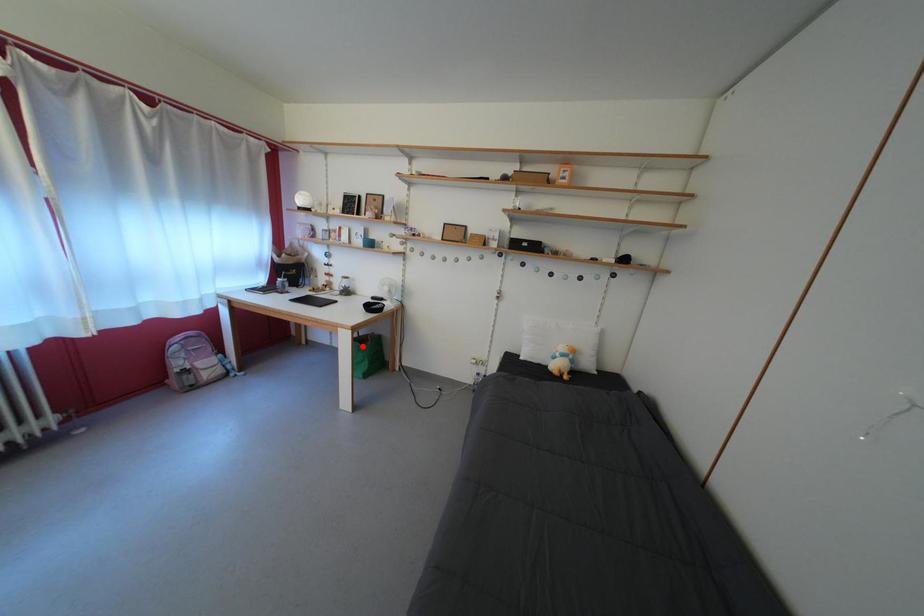
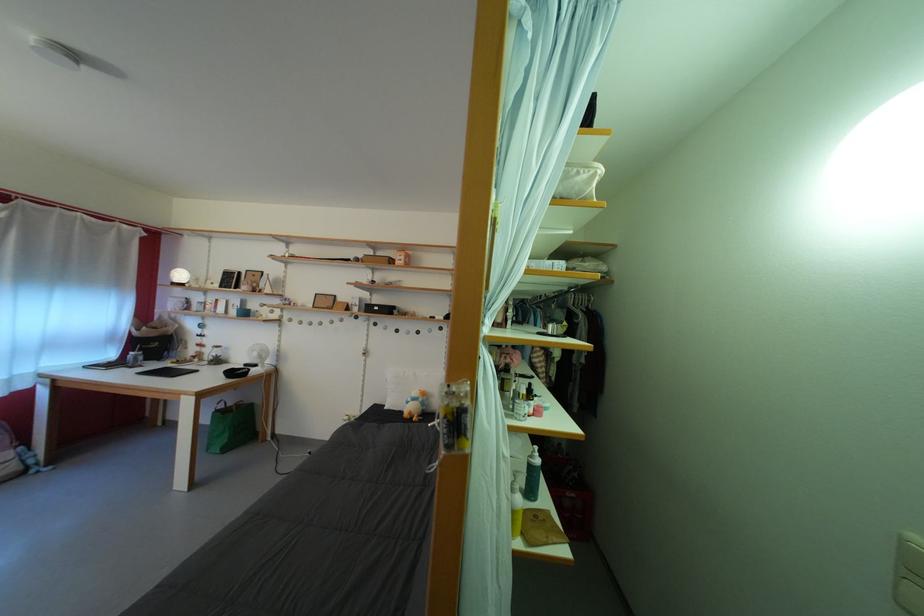
Question: I am providing you with two images of the same scene from different viewpoints. A red point is shown in image1. For the corresponding object point in image2, is it positioned nearer or farther from the camera?

Choices:
 (A) Nearer
 (B) Farther

Answer: (A)